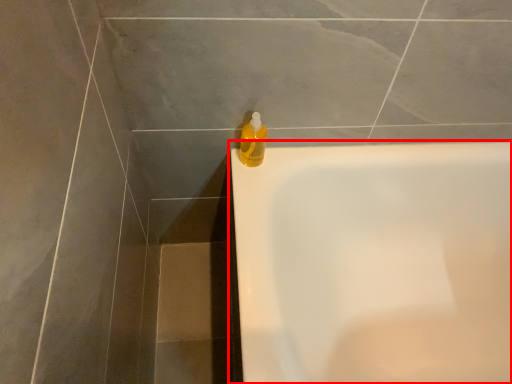
Question: Considering the relative positions of bathtub (annotated by the red box) and cleaning product in the image provided, where is bathtub (annotated by the red box) located with respect to the staircase?

Choices:
 (A) left
 (B) right

Answer: (B)